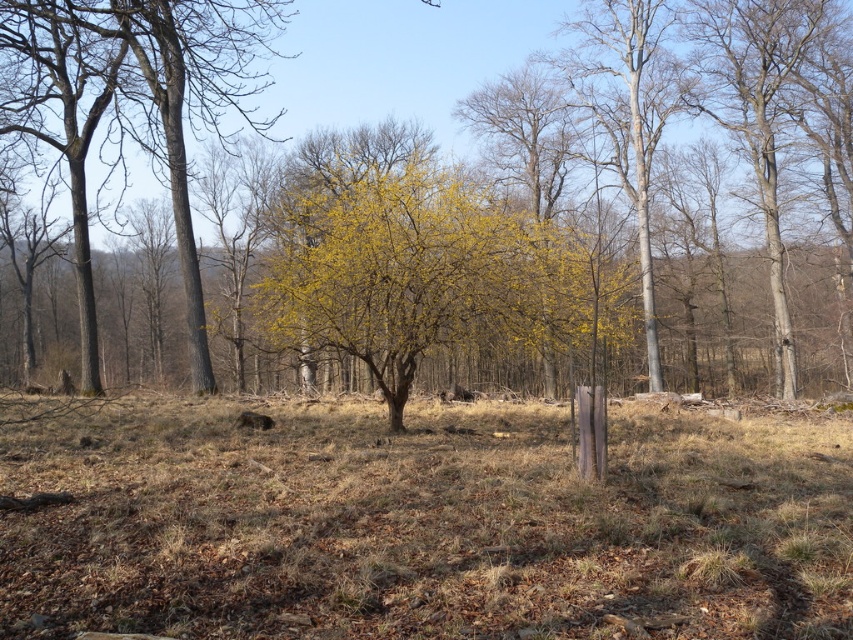
Can you confirm if yellow leafy tree at center is positioned to the left of yellow-green foliage at center?

Yes, yellow leafy tree at center is to the left of yellow-green foliage at center.

Measure the distance from yellow leafy tree at center to yellow-green foliage at center.

yellow leafy tree at center is 6.49 meters away from yellow-green foliage at center.

I want to click on yellow leafy tree at center, so click(x=566, y=198).

Find the location of a particular element. yellow leafy tree at center is located at coordinates (566, 198).

Between yellow leafy tree at center and smooth bark tree at left, which one is positioned higher?

smooth bark tree at left is higher up.

Does yellow leafy tree at center have a greater width compared to smooth bark tree at left?

Correct, the width of yellow leafy tree at center exceeds that of smooth bark tree at left.

Between point (376, 380) and point (117, 122), which one is positioned behind?

Point (117, 122)

Where is `yellow leafy tree at center`? This screenshot has width=853, height=640. yellow leafy tree at center is located at coordinates (566, 198).

Who is lower down, yellow leafy tree at center or bare wood at right?

bare wood at right is below.

Can you confirm if yellow leafy tree at center is positioned to the right of bare wood at right?

No, yellow leafy tree at center is not to the right of bare wood at right.

Is point (78, 28) positioned behind point (778, 368)?

No, (78, 28) is closer to viewer.

I want to click on yellow leafy tree at center, so click(566, 198).